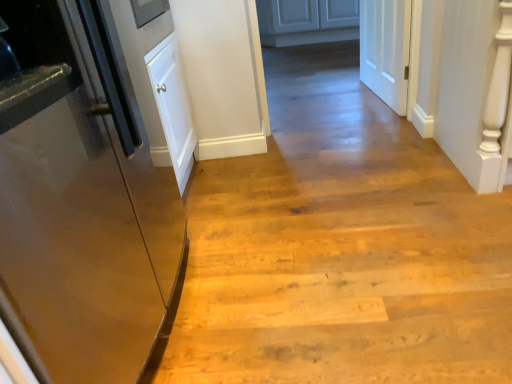
Image resolution: width=512 pixels, height=384 pixels. I want to click on free space behind white matte door at upper right, the 1th door when ordered from right to left, so click(336, 80).